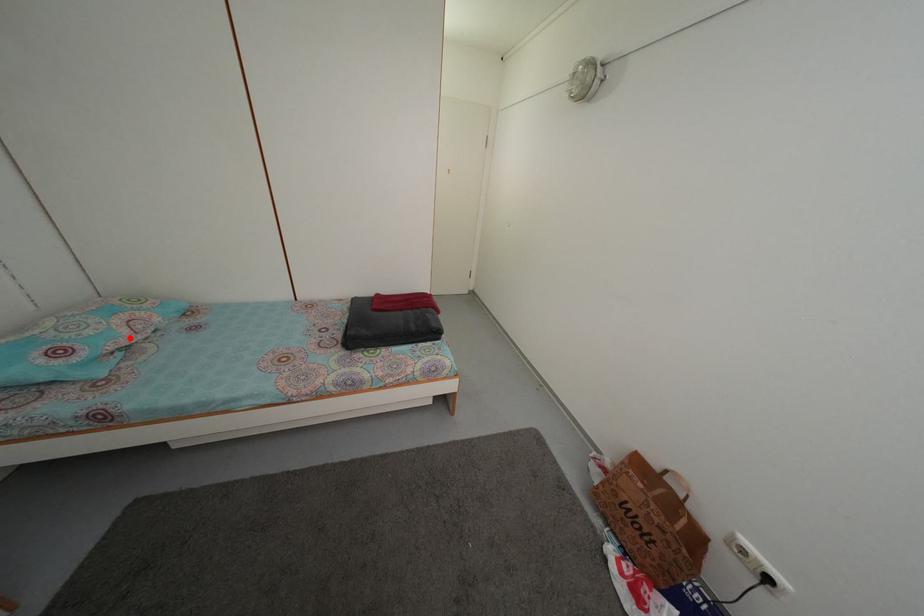
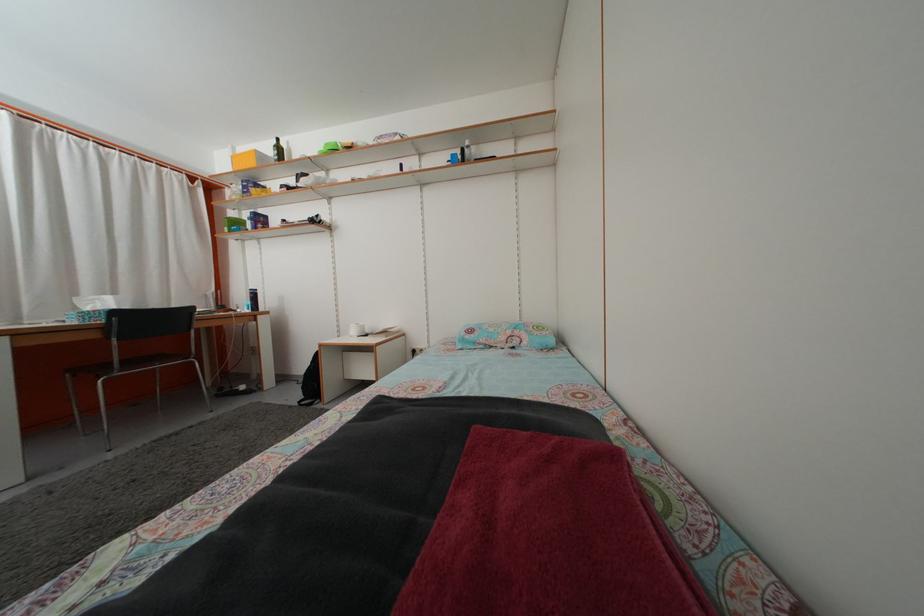
The point at the highlighted location is marked in the first image. Where is the corresponding point in the second image?

(508, 346)